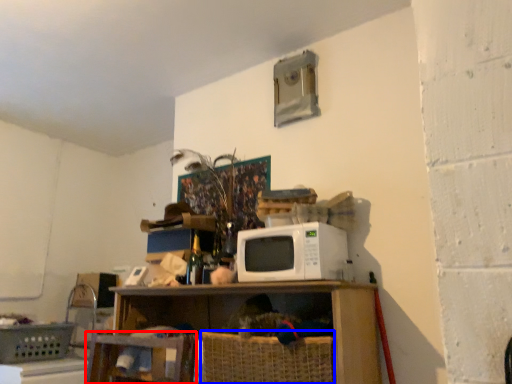
Question: Which of the following is the farthest to the observer, swivel chair (highlighted by a red box) or basket (highlighted by a blue box)?

Choices:
 (A) swivel chair
 (B) basket

Answer: (A)